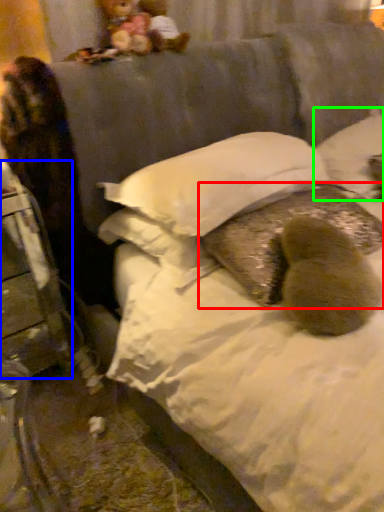
Question: Which is nearer to the pillow (highlighted by a red box)? furniture (highlighted by a blue box) or pillow (highlighted by a green box).

Choices:
 (A) furniture
 (B) pillow

Answer: (B)